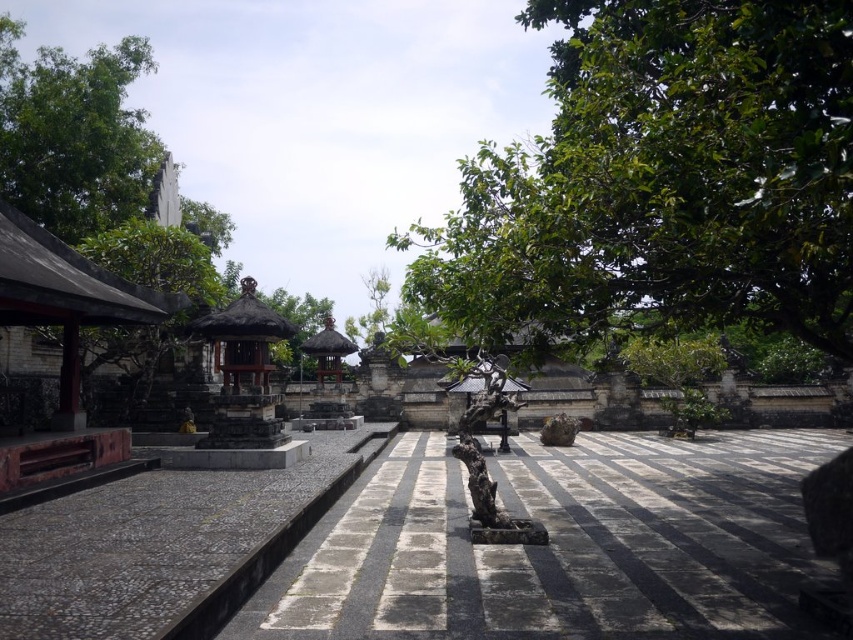
You are standing in the courtyard and want to place a small offering at the point closer to you between point (776, 58) and point (28, 136). Which point should you go to?

You should go to point (776, 58) because it is closer to the viewer than point (28, 136).

Looking at this image, you are standing at the camera position and want to take a photo of the green leafy tree at upper left. If your camera has a maximum focus range of 20 meters, will you be able to focus on the tree?

The green leafy tree at upper left and camera are 23.91 meters apart, which exceeds the camera maximum focus range of 20 meters. Therefore, you won not be able to focus on the green leafy tree at upper left.

You are standing in the courtyard and want to take a photo of both the green leafy tree at upper right and the green leafy tree at upper left. Which direction should you face to include both trees in your photo?

You should face towards the center of the courtyard to include both the green leafy tree at upper right and the green leafy tree at upper left in your photo, as the green leafy tree at upper right is positioned on the right side of green leafy tree at upper left.